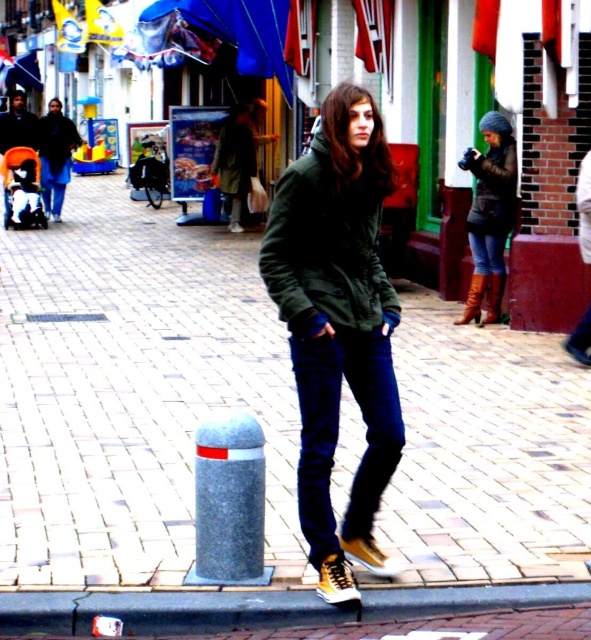
Based on the photo, you are a fashion designer observing a pedestrian on a busy street. You notice the dark green fabric jacket at center and the jeans at center. Which piece of clothing is positioned more to the left?

The dark green fabric jacket at center is to the left of jeans at center, so the jacket is positioned more to the left.

You are a photographer trying to capture the scene of the young woman walking. You notice the brown leather boots at center and the dark blue denim jeans at left. Which object is positioned to the right side of the other?

The brown leather boots at center is positioned to the right of dark blue denim jeans at left.